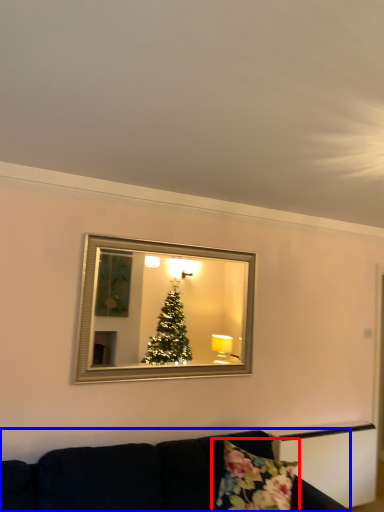
Question: Which object is closer to the camera taking this photo, pillow (highlighted by a red box) or studio couch (highlighted by a blue box)?

Choices:
 (A) pillow
 (B) studio couch

Answer: (B)